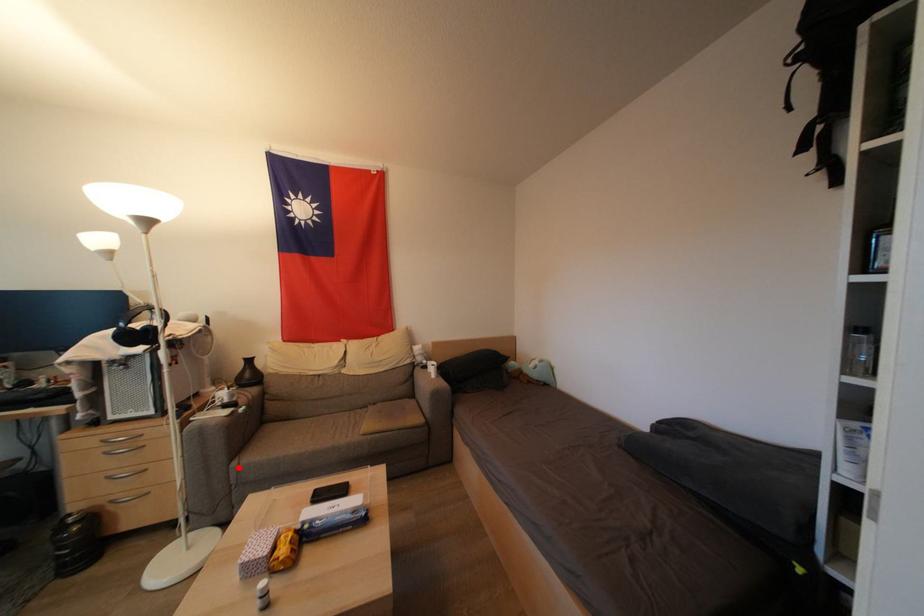
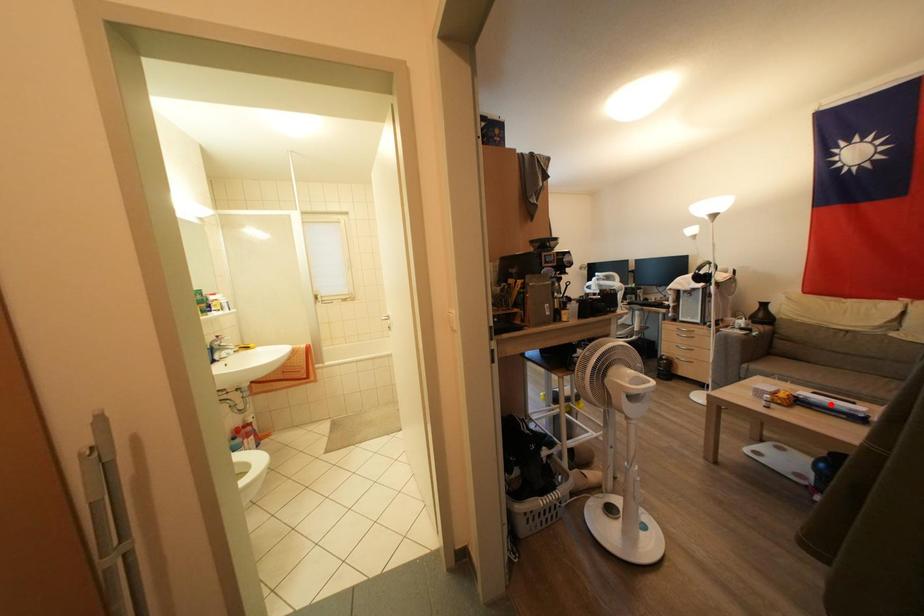
I am providing you with two images of the same scene from different viewpoints. A red point is marked on the first image and another point is marked on the second image. Is the marked point in image1 the same physical position as the marked point in image2?

No